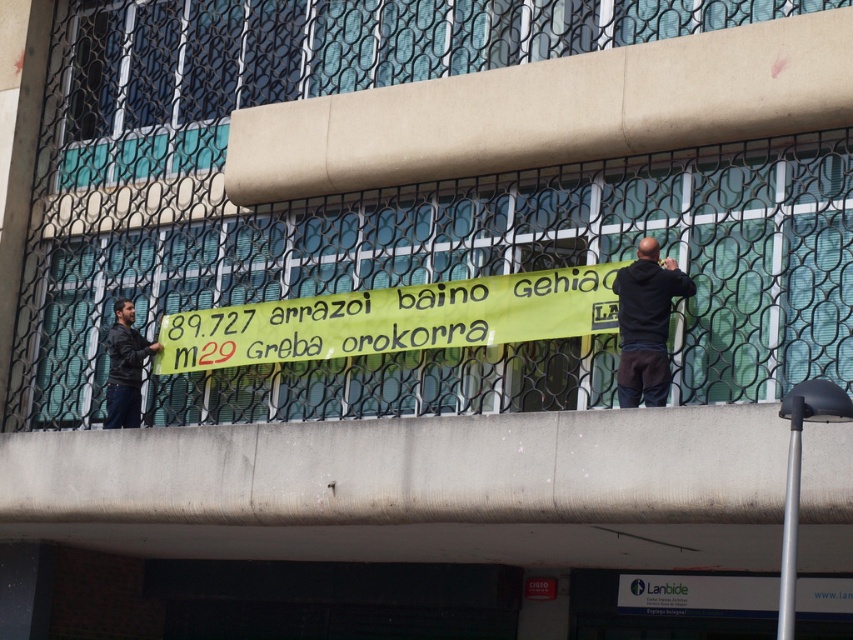
Question: Among these points, which one is nearest to the camera?

Choices:
 (A) (463, 342)
 (B) (114, 392)
 (C) (651, 404)

Answer: (C)

Question: Estimate the real-world distances between objects in this image. Which object is farther from the yellow fabric banner at center?

Choices:
 (A) green mesh fence at center
 (B) dark gray jacket at left
 (C) black hoodie at right

Answer: (A)

Question: Can you confirm if black hoodie at right is positioned above dark gray jacket at left?

Choices:
 (A) no
 (B) yes

Answer: (B)

Question: Is yellow fabric banner at center bigger than black hoodie at right?

Choices:
 (A) yes
 (B) no

Answer: (A)

Question: Does black hoodie at right have a smaller size compared to dark gray jacket at left?

Choices:
 (A) no
 (B) yes

Answer: (B)

Question: Which object appears closest to the camera in this image?

Choices:
 (A) green mesh fence at center
 (B) dark gray jacket at left
 (C) yellow fabric banner at center

Answer: (A)